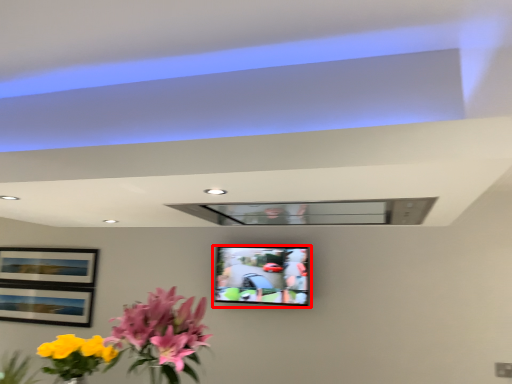
Question: Considering the relative positions of television (annotated by the red box) and flower in the image provided, where is television (annotated by the red box) located with respect to the staircase?

Choices:
 (A) left
 (B) right

Answer: (B)